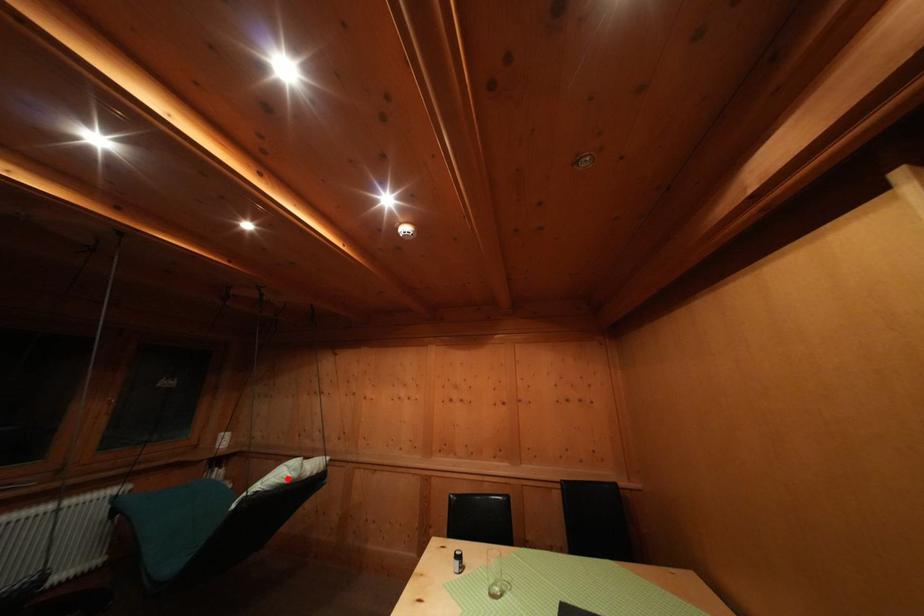
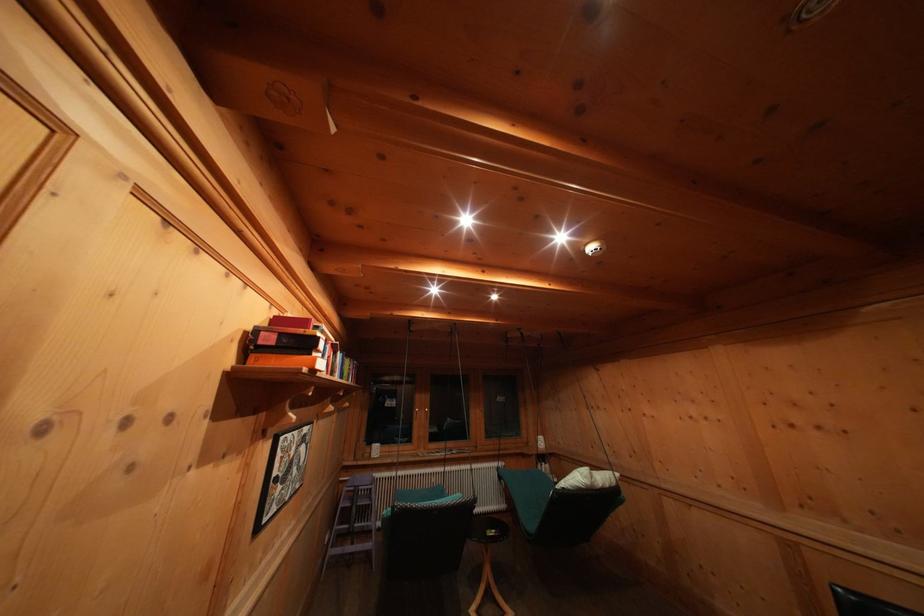
Question: I am providing you with two images of the same scene from different viewpoints. Given a red point in image1, look at the same physical point in image2. Is it:

Choices:
 (A) Closer to the viewpoint
 (B) Farther from the viewpoint

Answer: (A)